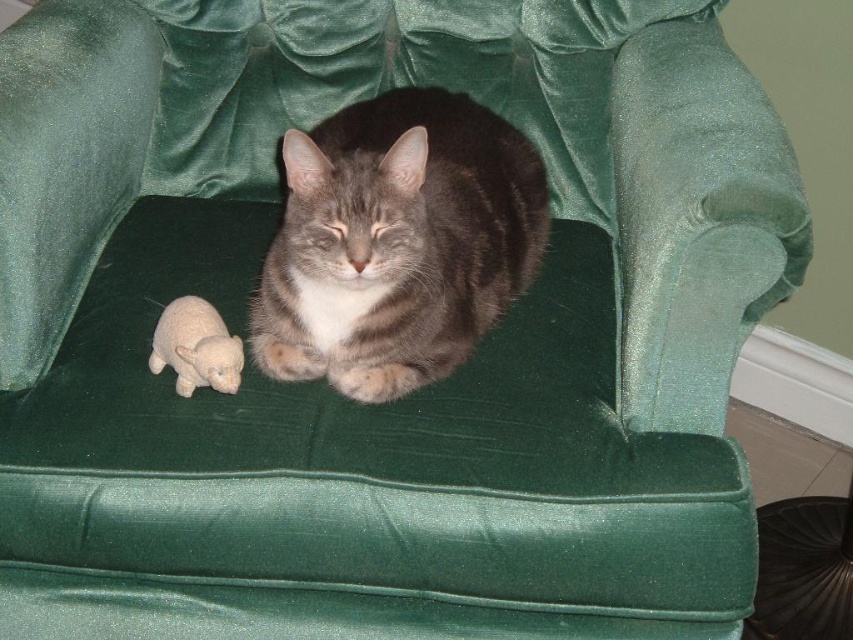
Question: Does gray striped fur cat at center appear on the right side of white plush bear at lower left?

Choices:
 (A) no
 (B) yes

Answer: (B)

Question: Is gray striped fur cat at center smaller than white plush bear at lower left?

Choices:
 (A) no
 (B) yes

Answer: (A)

Question: Considering the relative positions of gray striped fur cat at center and white plush bear at lower left in the image provided, where is gray striped fur cat at center located with respect to white plush bear at lower left?

Choices:
 (A) below
 (B) above

Answer: (B)